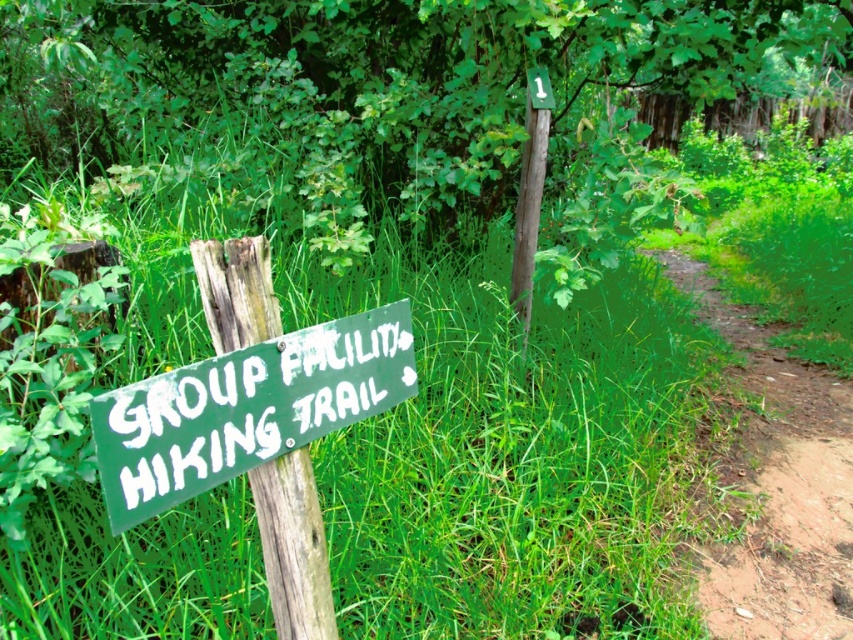
Question: Among these objects, which one is farthest from the camera?

Choices:
 (A) brown dirt trail at center-right
 (B) green wood post at center
 (C) green wood signpost at left

Answer: (B)

Question: Which is nearer to the green wood signpost at left?

Choices:
 (A) green painted wood sign at left
 (B) green wood post at center

Answer: (A)

Question: Based on their relative distances, which object is farther from the green wood post at center?

Choices:
 (A) green wood signpost at left
 (B) brown dirt trail at center-right

Answer: (A)

Question: From the image, what is the correct spatial relationship of green painted wood sign at left in relation to brown dirt trail at center-right?

Choices:
 (A) below
 (B) above

Answer: (B)

Question: Does brown dirt trail at center-right appear under green wood signpost at left?

Choices:
 (A) no
 (B) yes

Answer: (B)

Question: Is green painted wood sign at left positioned in front of brown dirt trail at center-right?

Choices:
 (A) yes
 (B) no

Answer: (A)